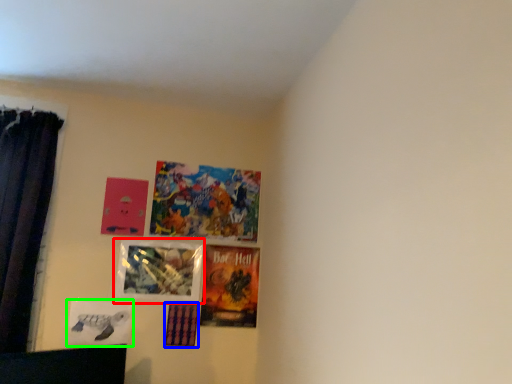
Question: Which is nearer to the picture frame (highlighted by a red box)? picture frame (highlighted by a blue box) or picture frame (highlighted by a green box).

Choices:
 (A) picture frame
 (B) picture frame

Answer: (A)